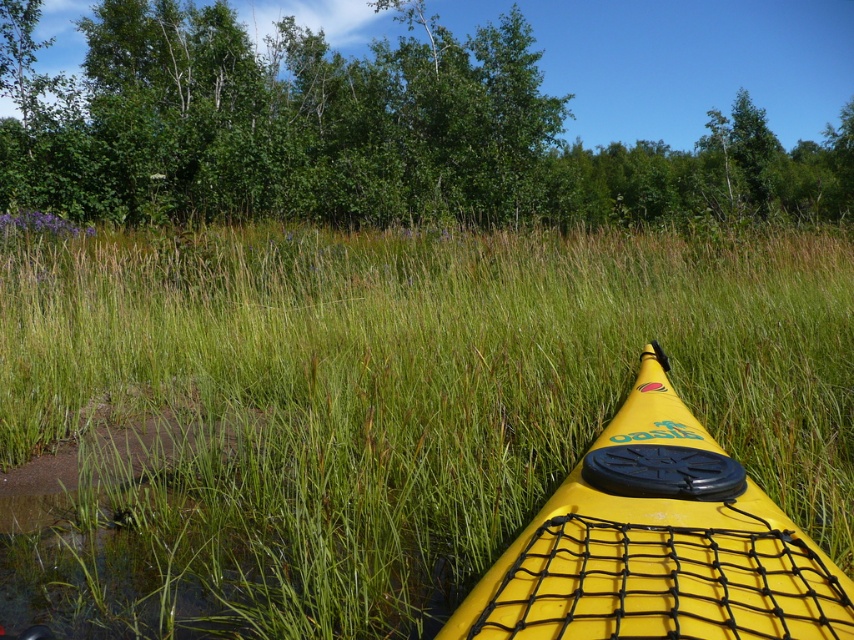
Between green grassy at center and green leafy tree at upper center, which one appears on the right side from the viewer's perspective?

Positioned to the right is green leafy tree at upper center.

Is green grassy at center smaller than green leafy tree at upper center?

Yes, green grassy at center is smaller than green leafy tree at upper center.

Is point (384, 522) farther from viewer compared to point (753, 180)?

No, (384, 522) is closer to viewer.

You are a GUI agent. You are given a task and a screenshot of the screen. Output one action in this format:
    pyautogui.click(x=<x>, y=<y>)
    Task: Click on the green grassy at center
    
    Given the screenshot: What is the action you would take?
    pyautogui.click(x=385, y=406)

Which is in front, point (279, 51) or point (624, 598)?

Point (624, 598) is in front.

The image size is (854, 640). Describe the element at coordinates (360, 132) in the screenshot. I see `green leafy tree at upper center` at that location.

Who is more distant from viewer, (120, 116) or (606, 612)?

The point (120, 116) is behind.

Find the location of a particular element. green leafy tree at upper center is located at coordinates (360, 132).

Does green grassy at center have a larger size compared to yellow matte kayak at center?

Yes, green grassy at center is bigger than yellow matte kayak at center.

Between point (384, 333) and point (501, 572), which one is positioned behind?

Point (384, 333)

You are a GUI agent. You are given a task and a screenshot of the screen. Output one action in this format:
    pyautogui.click(x=<x>, y=<y>)
    Task: Click on the green grassy at center
    Image resolution: width=854 pixels, height=640 pixels.
    Given the screenshot: What is the action you would take?
    click(385, 406)